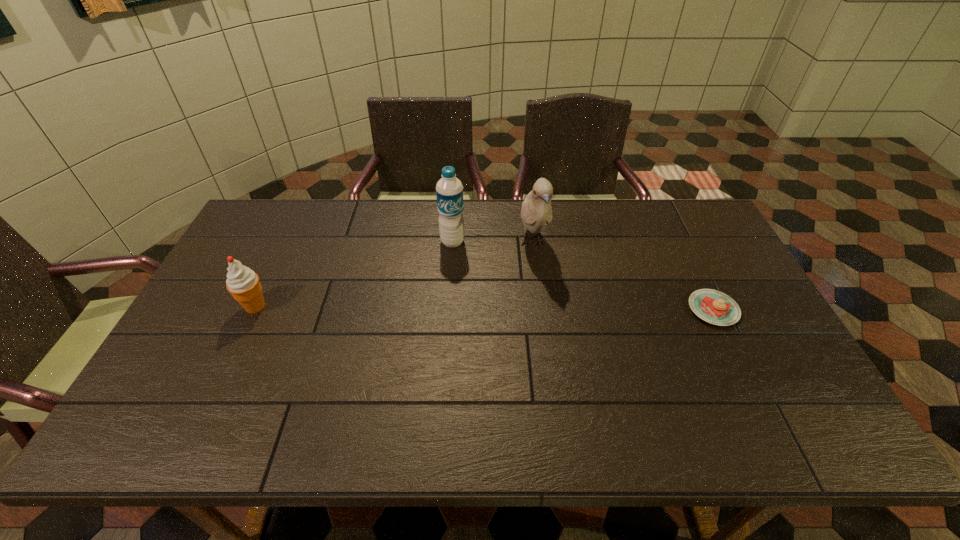
At what (x,y) coordinates should I click in order to perform the action: click on vacant space on the desktop that is between the icecream and the pastry and is positioned at the beak of the third object from left to right. Please return your answer as a coordinate pair (x, y). Looking at the image, I should click on (550, 308).

Identify the location of vacant space on the desktop that is between the leftmost object and the shortest object and is positioned on the label of the water bottle. The width and height of the screenshot is (960, 540). (433, 308).